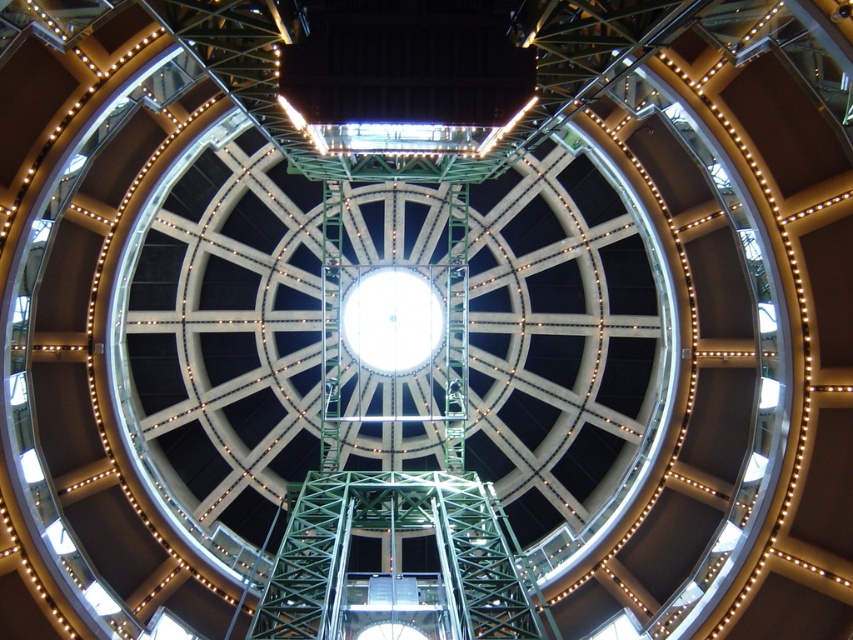
Who is lower down, green metallic structure at center or white glass clock at center?

green metallic structure at center is below.

Is green metallic structure at center to the left of white glass clock at center from the viewer's perspective?

Incorrect, green metallic structure at center is not on the left side of white glass clock at center.

Is point (399, 285) farther from viewer compared to point (421, 358)?

No, it is not.

The height and width of the screenshot is (640, 853). What are the coordinates of `green metallic structure at center` in the screenshot? It's located at (393, 468).